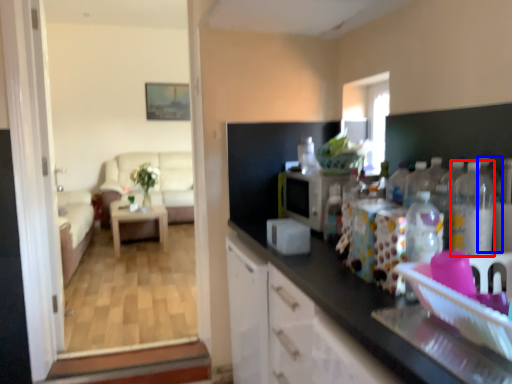
Question: Among these objects, which one is nearest to the camera, bottle (highlighted by a red box) or bottle (highlighted by a blue box)?

Choices:
 (A) bottle
 (B) bottle

Answer: (A)